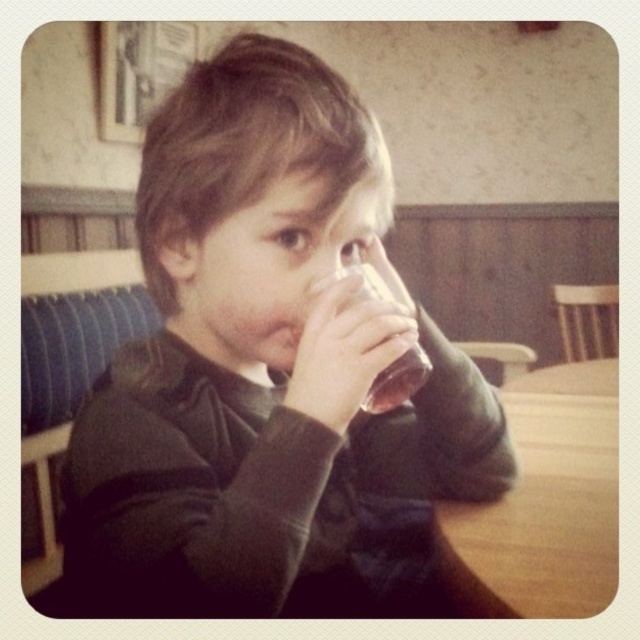
Question: Can you confirm if wooden table at lower right is bigger than translucent glass at mouth?

Choices:
 (A) yes
 (B) no

Answer: (A)

Question: Does matte glass at center appear on the right side of translucent glass at mouth?

Choices:
 (A) yes
 (B) no

Answer: (B)

Question: Which of the following is the closest to the observer?

Choices:
 (A) (512, 602)
 (B) (365, 273)

Answer: (B)

Question: Among these points, which one is farthest from the camera?

Choices:
 (A) (371, 298)
 (B) (449, 456)
 (C) (493, 513)

Answer: (C)

Question: Which of the following is the farthest from the observer?

Choices:
 (A) (406, 378)
 (B) (612, 413)
 (C) (243, 522)

Answer: (B)

Question: Is wooden table at lower right bigger than translucent glass at mouth?

Choices:
 (A) no
 (B) yes

Answer: (B)